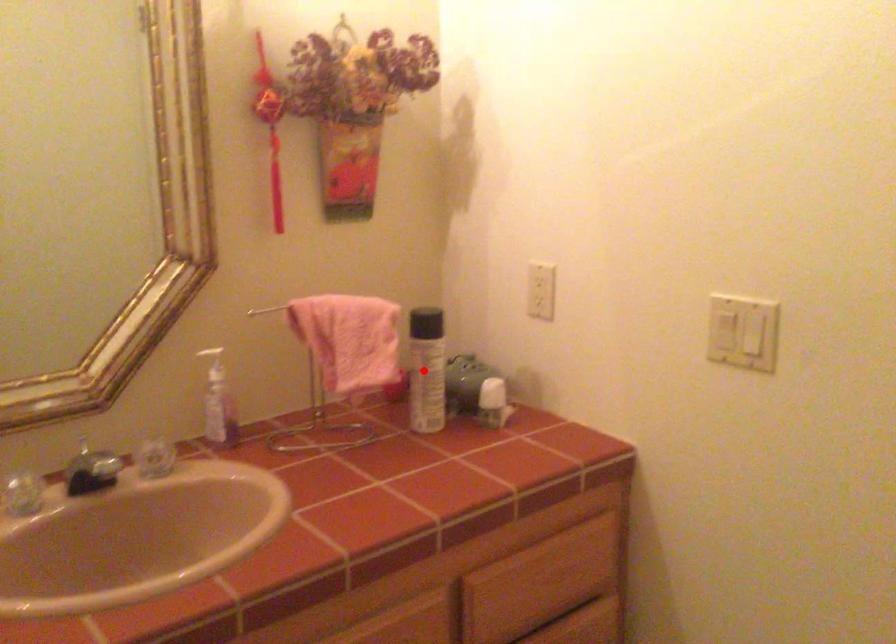
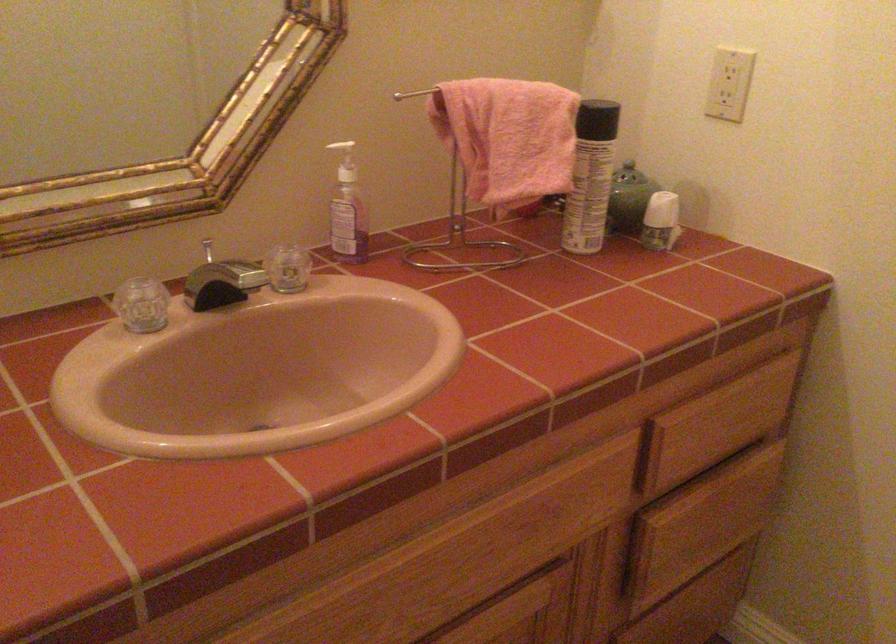
Find the pixel in the second image that matches the highlighted location in the first image.

(590, 176)